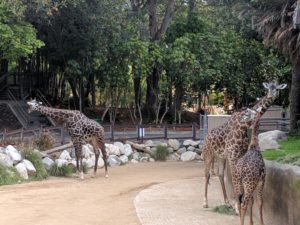
This screenshot has width=300, height=225. Identify the location of tiles. (176, 214), (176, 185).